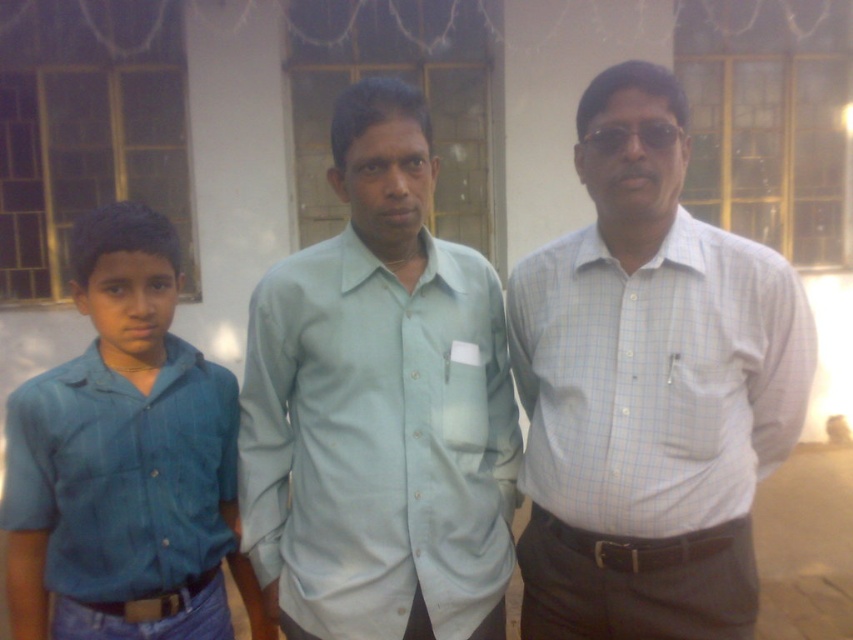
Between point (492, 586) and point (158, 241), which one is positioned behind?

Positioned behind is point (492, 586).

Which of these two, light blue cotton shirt at center or blue denim shirt at left, stands taller?

blue denim shirt at left is taller.

What do you see at coordinates (378, 440) in the screenshot? The image size is (853, 640). I see `light blue cotton shirt at center` at bounding box center [378, 440].

Identify the location of light blue cotton shirt at center. This screenshot has width=853, height=640. (378, 440).

Consider the image. Which is more to the left, white checkered shirt at center or blue denim shirt at left?

Positioned to the left is blue denim shirt at left.

Who is more distant from viewer, (665, 216) or (218, 426)?

Positioned behind is point (218, 426).

Locate an element on the screen. Image resolution: width=853 pixels, height=640 pixels. white checkered shirt at center is located at coordinates (648, 388).

Is white checkered shirt at center wider than light blue cotton shirt at center?

No.

Does white checkered shirt at center have a lesser height compared to light blue cotton shirt at center?

In fact, white checkered shirt at center may be taller than light blue cotton shirt at center.

Where is `white checkered shirt at center`? This screenshot has width=853, height=640. white checkered shirt at center is located at coordinates (648, 388).